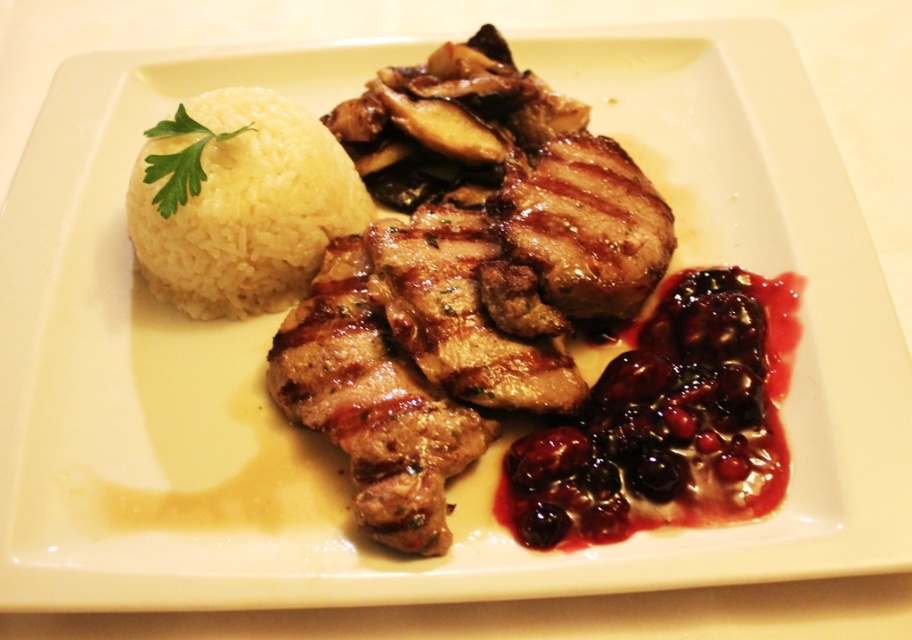
Is savory berry sauce at lower right to the left of white polished rice at upper left from the viewer's perspective?

→ In fact, savory berry sauce at lower right is to the right of white polished rice at upper left.

Is point (750, 508) less distant than point (286, 236)?

Yes, it is.

Is point (547, 428) closer to camera compared to point (148, 172)?

Yes.

In order to click on savory berry sauce at lower right in this screenshot , I will do `click(667, 420)`.

The height and width of the screenshot is (640, 912). In order to click on grilled meat at center in this screenshot , I will do `click(464, 323)`.

Locate an element on the screen. The width and height of the screenshot is (912, 640). grilled meat at center is located at coordinates coord(464,323).

In the scene shown: Who is more forward, (270, 236) or (241, 131)?

Point (241, 131) is in front.

Is white polished rice at upper left wider than green leafy parsley at upper left?

Correct, the width of white polished rice at upper left exceeds that of green leafy parsley at upper left.

Between point (185, 232) and point (171, 200), which one is positioned behind?

The point (185, 232) is behind.

At what (x,y) coordinates should I click in order to perform the action: click on white polished rice at upper left. Please return your answer as a coordinate pair (x, y). Looking at the image, I should click on (239, 204).